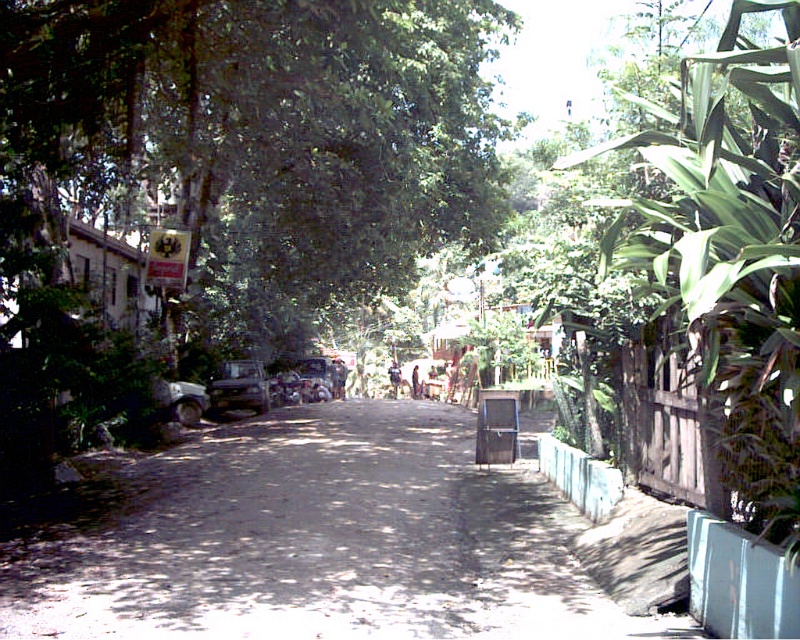
Which is behind, point (360, 141) or point (236, 404)?

Point (236, 404)

Is green leafy tree at upper center positioned behind metallic silver van at center?

No.

Locate an element on the screen. green leafy tree at upper center is located at coordinates (260, 138).

Which is behind, point (436, 625) or point (188, 417)?

The point (188, 417) is more distant.

Who is positioned more to the right, dirt road at center or white matte car at left?

dirt road at center is more to the right.

Find the location of a particular element. The width and height of the screenshot is (800, 640). dirt road at center is located at coordinates (322, 541).

Does white matte car at left have a larger size compared to metallic silver car at center?

No, white matte car at left is not bigger than metallic silver car at center.

What do you see at coordinates (180, 401) in the screenshot?
I see `white matte car at left` at bounding box center [180, 401].

This screenshot has height=640, width=800. In order to click on white matte car at left in this screenshot , I will do `click(180, 401)`.